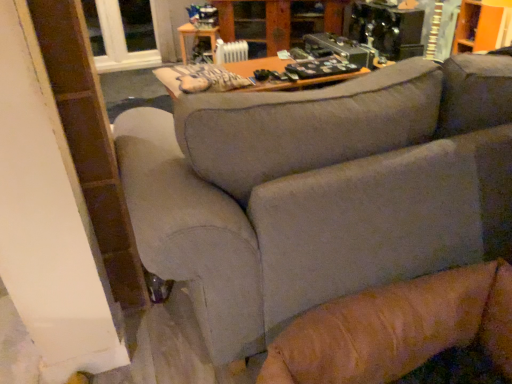
Question: Would you say gray fabric couch at center is inside or outside clear glass window at upper left?

Choices:
 (A) inside
 (B) outside

Answer: (B)

Question: From the image's perspective, is gray fabric couch at center positioned above or below clear glass window at upper left?

Choices:
 (A) above
 (B) below

Answer: (B)

Question: Which of these objects is positioned farthest from the wooden table at center?

Choices:
 (A) white plastic radiator at upper center
 (B) wooden cabinet at upper center
 (C) clear glass window at upper left
 (D) gray fabric couch at center

Answer: (D)

Question: Based on their relative distances, which object is nearer to the white plastic radiator at upper center?

Choices:
 (A) gray fabric couch at center
 (B) wooden cabinet at upper center
 (C) clear glass window at upper left
 (D) wooden table at center

Answer: (B)